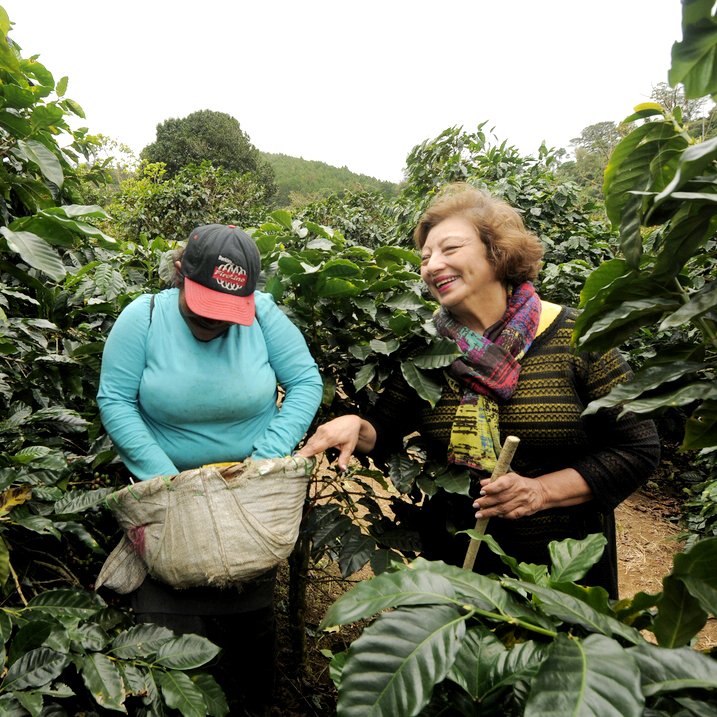
Identify the location of basket. (214, 511), (224, 252).